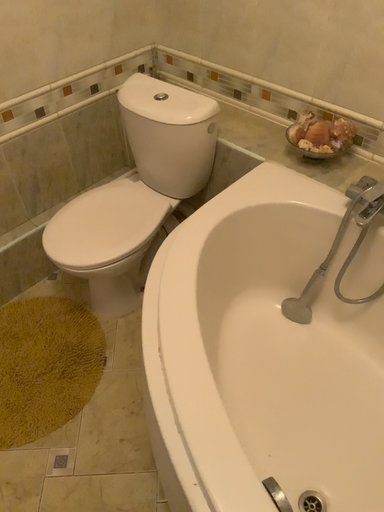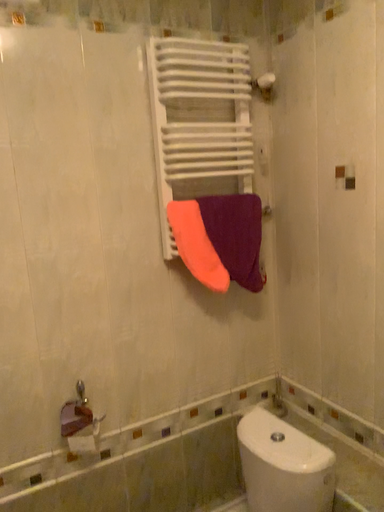
Question: How did the camera likely rotate when shooting the video?

Choices:
 (A) rotated right
 (B) rotated left

Answer: (B)